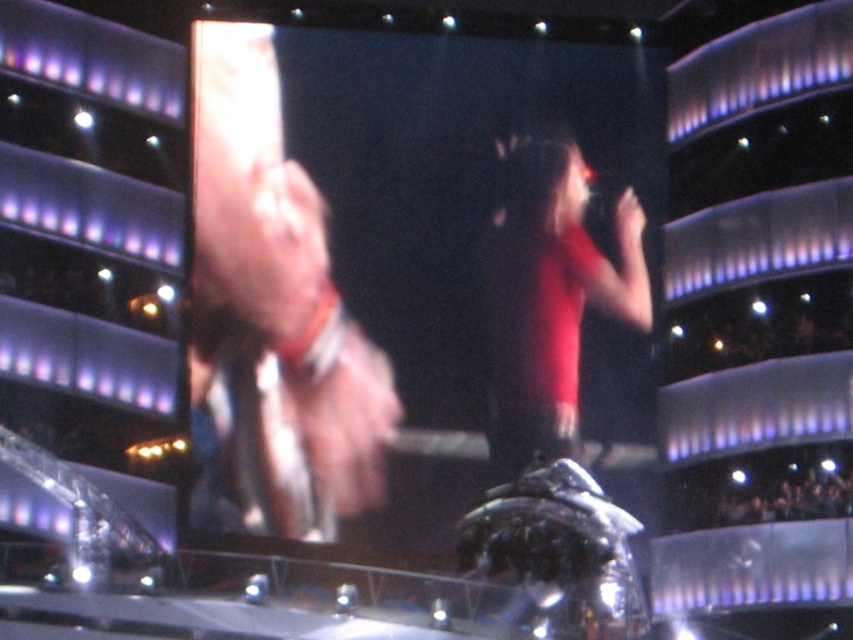
Is point (294, 294) in front of point (543, 317)?

Yes, it is.

Can you confirm if smooth skin hand at center is wider than matte red shirt at center?

Yes, smooth skin hand at center is wider than matte red shirt at center.

Does point (299, 246) come in front of point (517, 269)?

That is True.

Image resolution: width=853 pixels, height=640 pixels. Identify the location of smooth skin hand at center. (276, 294).